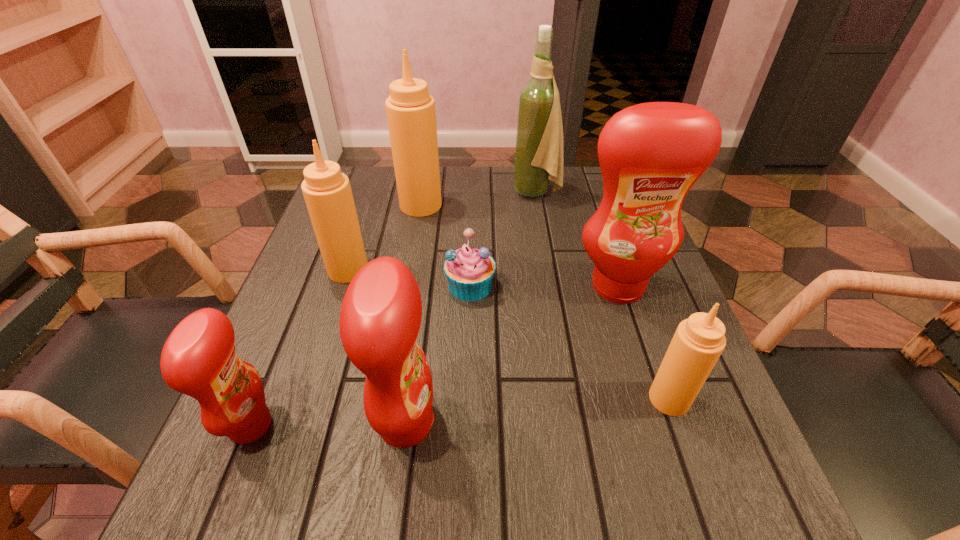
The height and width of the screenshot is (540, 960). Find the location of `free space at the far left corner of the desktop`. free space at the far left corner of the desktop is located at coordinates [x=371, y=191].

Where is `free space at the far right corner of the desktop`? The width and height of the screenshot is (960, 540). free space at the far right corner of the desktop is located at coordinates (571, 191).

Locate an element on the screen. free spot between the farthest tan condiment and the rightmost tan condiment is located at coordinates (545, 302).

Identify the location of free area in between the leftmost red condiment and the leftmost tan condiment. (300, 347).

What are the coordinates of `free space between the leftmost red condiment and the second tan condiment from left to right` in the screenshot? It's located at (336, 315).

Where is `free space between the second nearest tan condiment and the rightmost tan condiment`? This screenshot has width=960, height=540. free space between the second nearest tan condiment and the rightmost tan condiment is located at coordinates (509, 334).

Identify the location of free space between the rightmost red condiment and the second red condiment from left to right. The height and width of the screenshot is (540, 960). (512, 354).

Identify the location of unoccupied area between the second smallest red condiment and the smallest red condiment. (328, 424).

Locate which object is the closest to the shortest object. Please provide its 2D coordinates. Your answer should be formatted as a tuple, i.e. [(x, y)], where the tuple contains the x and y coordinates of a point satisfying the conditions above.

[(651, 154)]

Point out which object is positioned as the third nearest to the blue muffin. Please provide its 2D coordinates. Your answer should be formatted as a tuple, i.e. [(x, y)], where the tuple contains the x and y coordinates of a point satisfying the conditions above.

[(380, 318)]